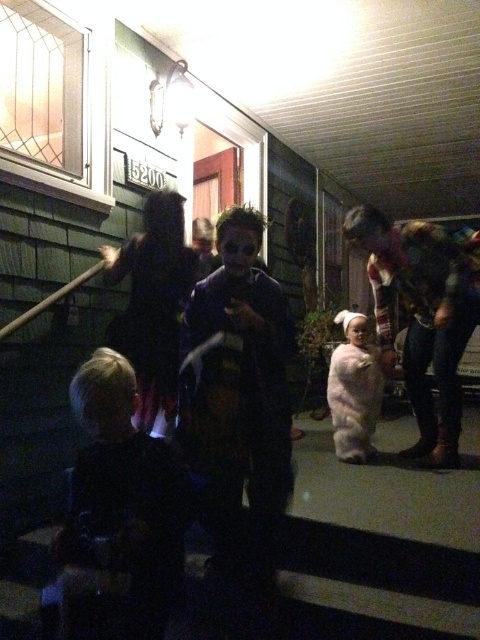
You are standing on the sidewalk across the street from the house and want to see which person is taller between the matte black costume at center and the dark blue shirt at lower left. Based on the scene, which one appears taller?

The matte black costume at center appears taller than the dark blue shirt at lower left as stated in the object description.

You are standing on the porch and want to greet the person wearing the dark blue shirt at lower left. Which direction should you move to reach them from the matte black costume at center?

Answer: The matte black costume at center is positioned on the right side of dark blue shirt at lower left. To reach the dark blue shirt at lower left from the matte black costume at center, you should move to the left.